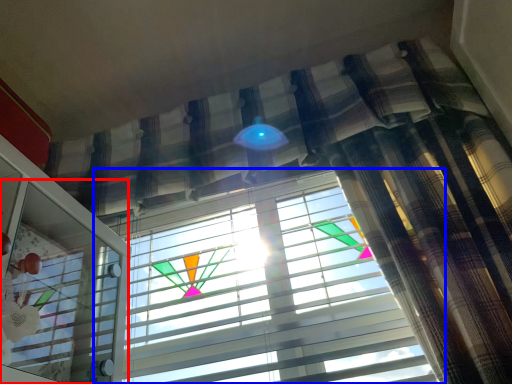
Question: Which object is closer to the camera taking this photo, screen door (highlighted by a red box) or window blind (highlighted by a blue box)?

Choices:
 (A) screen door
 (B) window blind

Answer: (A)